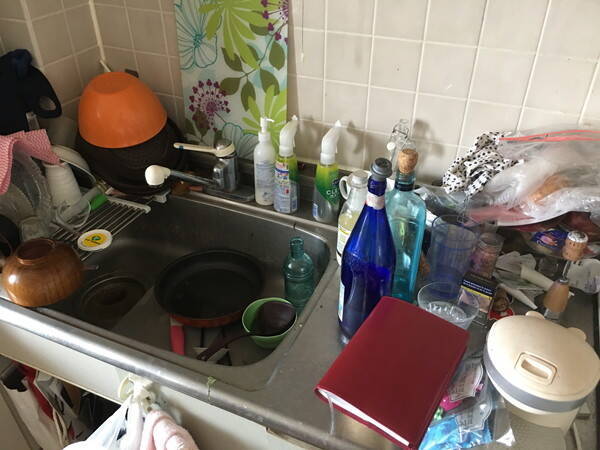
This screenshot has width=600, height=450. I want to click on sink, so click(x=192, y=212).